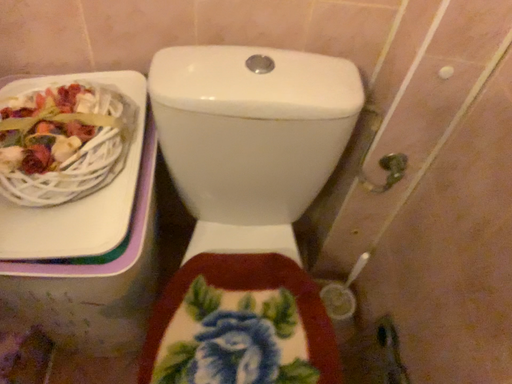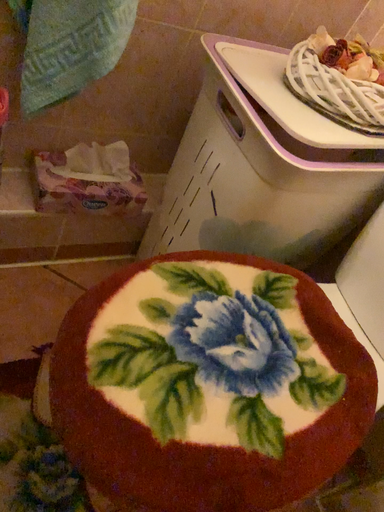
Question: Which way did the camera rotate in the video?

Choices:
 (A) rotated upward
 (B) rotated downward

Answer: (A)